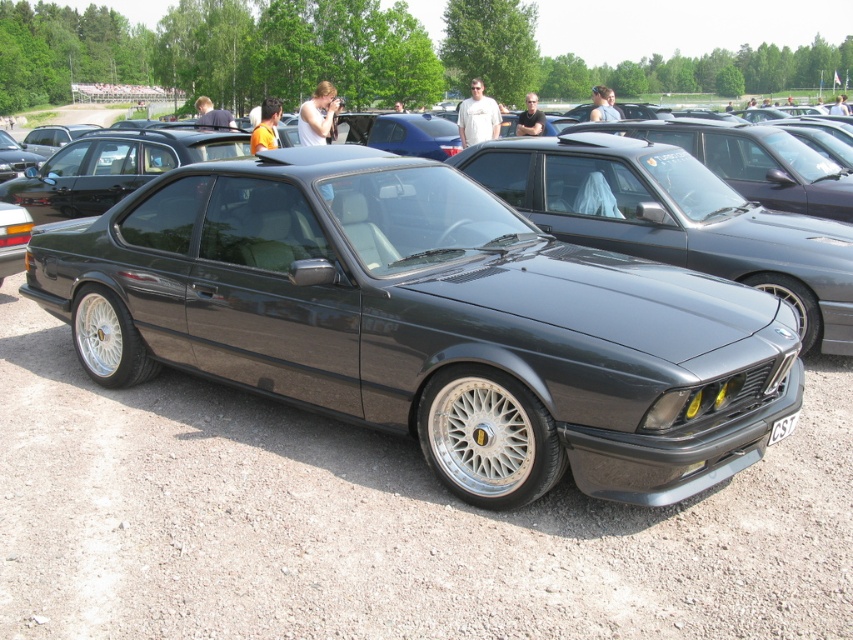
Question: Is metallic gray car at center positioned in front of black plastic license plate at center?

Choices:
 (A) yes
 (B) no

Answer: (A)

Question: Can you confirm if satin black car at center is thinner than black plastic license plate at center?

Choices:
 (A) yes
 (B) no

Answer: (B)

Question: Which object is positioned closest to the black plastic license plate at center?

Choices:
 (A) metallic gray car at center
 (B) satin black car at center

Answer: (A)

Question: Which point is closer to the camera?

Choices:
 (A) black plastic license plate at center
 (B) satin black car at center

Answer: (A)

Question: Does metallic gray car at center appear on the left side of satin black car at center?

Choices:
 (A) no
 (B) yes

Answer: (B)

Question: Which point is closer to the camera?

Choices:
 (A) metallic gray car at center
 (B) black plastic license plate at center

Answer: (A)